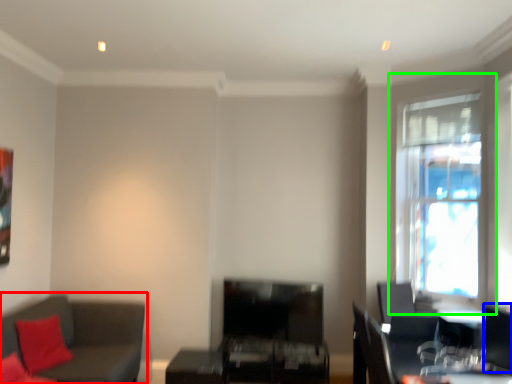
Question: Considering the real-world distances, which object is farthest from studio couch (highlighted by a red box)? swivel chair (highlighted by a blue box) or window (highlighted by a green box)?

Choices:
 (A) swivel chair
 (B) window

Answer: (B)